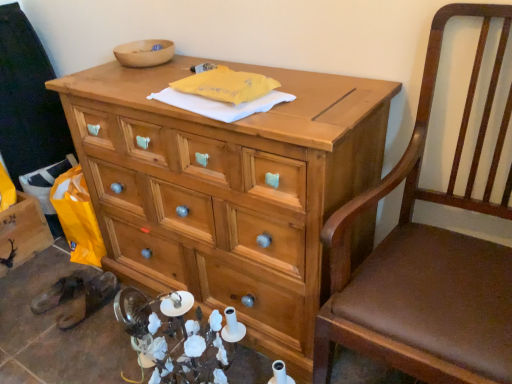
What are the coordinates of `free spot above natural wood desk at center (from a real-world perspective)` in the screenshot? It's located at (245, 69).